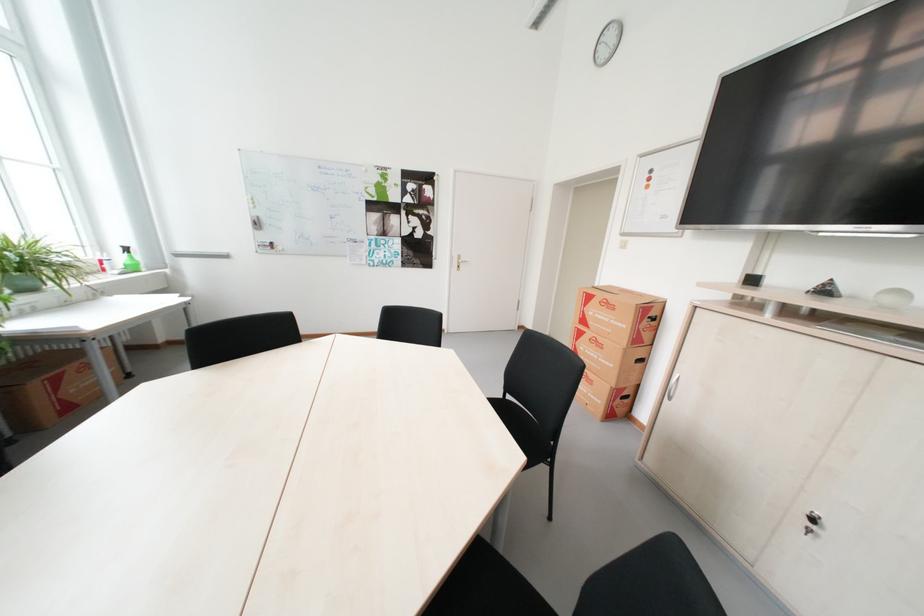
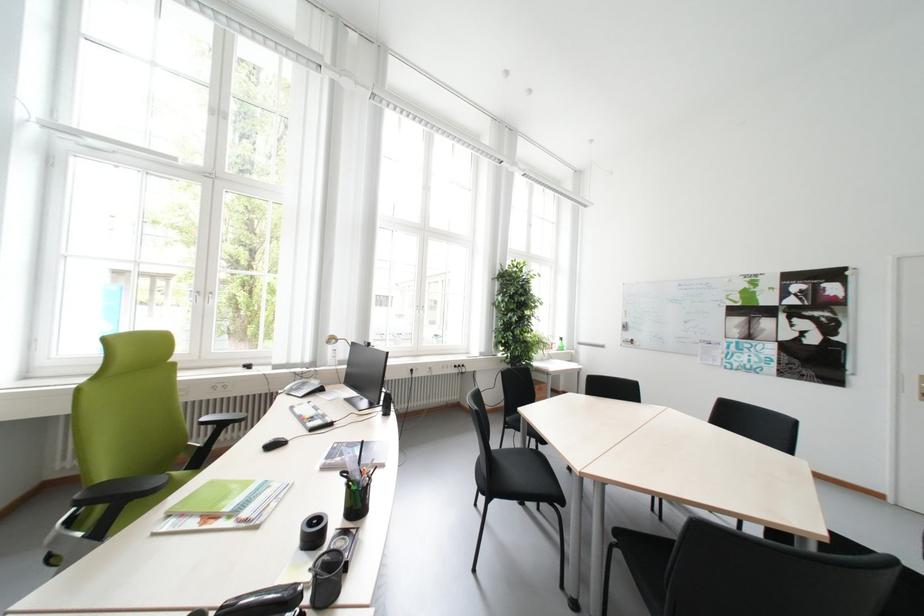
In the second image, find the point that corresponds to pixel 247 240 in the first image.

(621, 338)